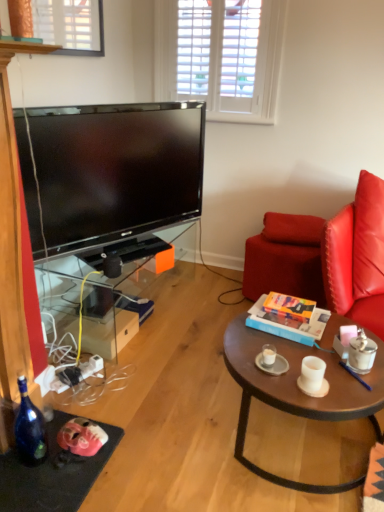
I want to click on unoccupied space behind white matte coffee cup at center, acting as the 1th coffee cup starting from the left, so click(x=265, y=340).